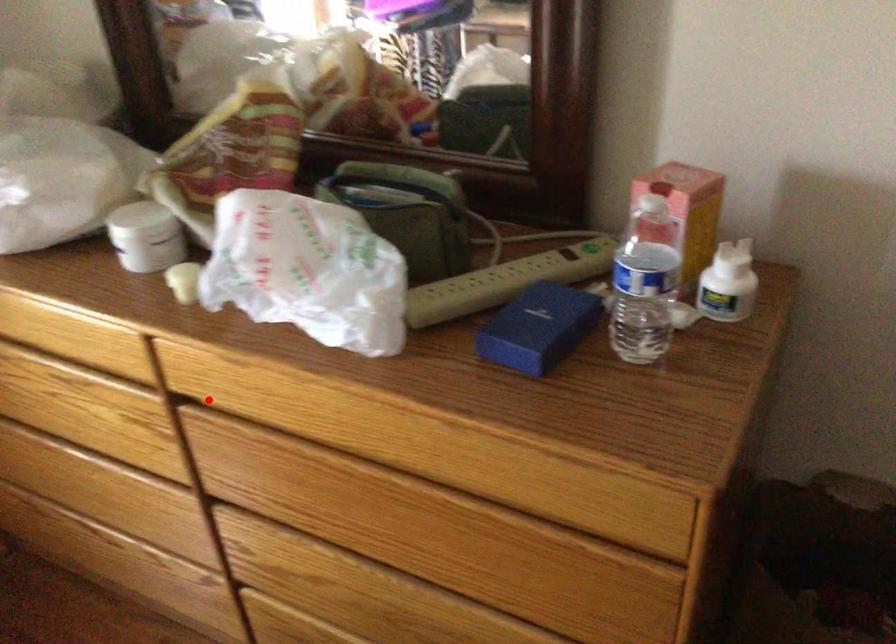
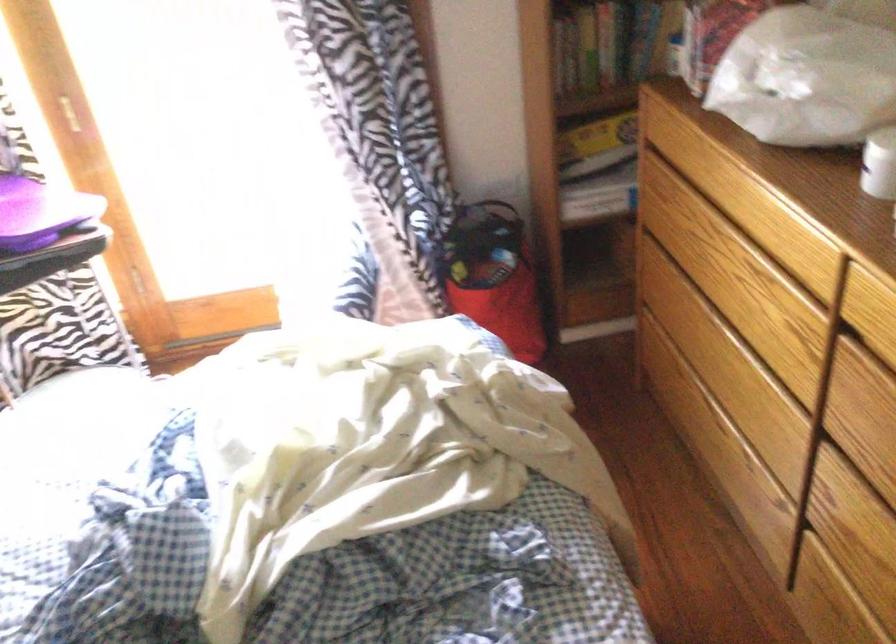
In the second image, find the point that corresponds to the highlighted location in the first image.

(874, 339)